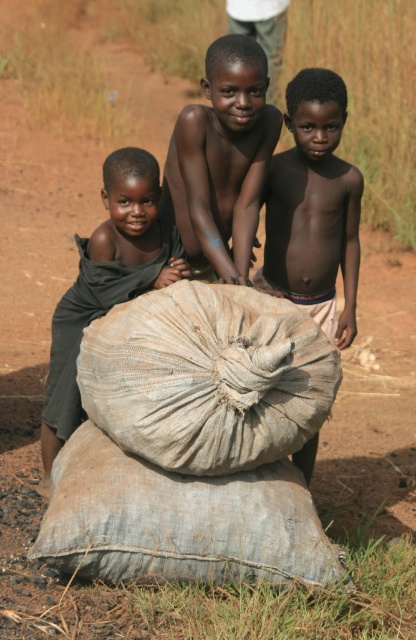
You are a photographer trying to capture the middle boy in the image. The middle boy is represented by the point at coordinates (314, 208). Where should you focus your camera to ensure the middle boy is in the center of the photo?

To center the smooth skin boy at center, focus your camera on the point at coordinates (314, 208).

Based on the scene description, where is the brown matte boy at center located in the image?

The brown matte boy at center is located at point coordinates of (222, 161).

You are a photographer trying to capture the smooth skin boy at center and the dark green fabric at left in a single frame. Based on their sizes in the image, which object would you focus on first to ensure both are in the frame?

The smooth skin boy at center occupies less space than the dark green fabric at left, so you should focus on the dark green fabric at left first to ensure both are in the frame since it takes up more space and can help frame the smaller subject.